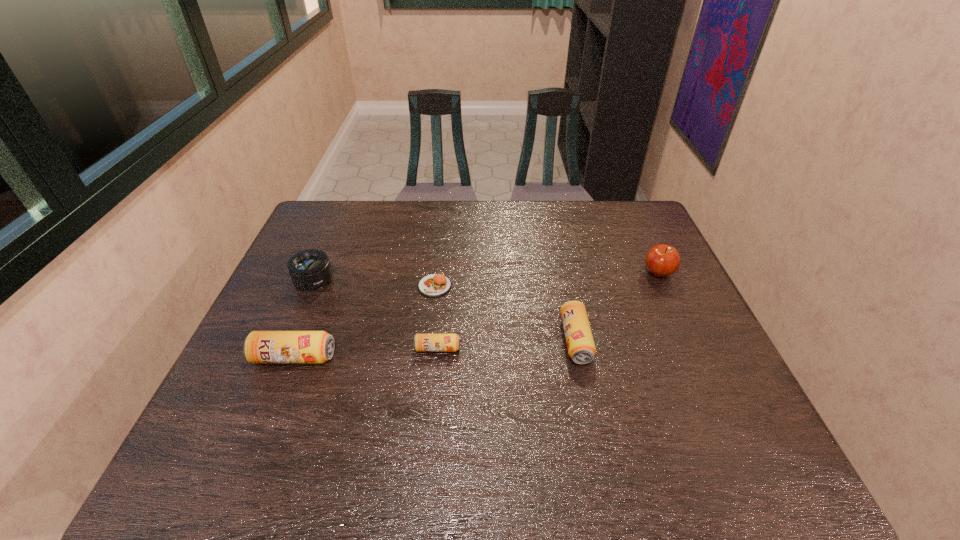
Image resolution: width=960 pixels, height=540 pixels. In order to click on free space between the telephoto lens and the fifth object from left to right in this screenshot , I will do `click(444, 310)`.

Find the location of a particular element. vacant point located between the telephoto lens and the apple is located at coordinates (486, 277).

The height and width of the screenshot is (540, 960). In order to click on free space between the leftmost beer can and the shortest object in this screenshot , I will do `click(365, 322)`.

Locate which object ranks third in proximity to the telephoto lens. Please provide its 2D coordinates. Your answer should be formatted as a tuple, i.e. [(x, y)], where the tuple contains the x and y coordinates of a point satisfying the conditions above.

[(422, 342)]

Identify which object is located as the third nearest to the telephoto lens. Please provide its 2D coordinates. Your answer should be formatted as a tuple, i.e. [(x, y)], where the tuple contains the x and y coordinates of a point satisfying the conditions above.

[(422, 342)]

Image resolution: width=960 pixels, height=540 pixels. I want to click on beer can that is the second closest to the second shortest beer can, so click(259, 346).

This screenshot has width=960, height=540. In order to click on beer can identified as the third closest to the tallest object in this screenshot , I will do `click(259, 346)`.

Locate an element on the screen. Image resolution: width=960 pixels, height=540 pixels. vacant point that satisfies the following two spatial constraints: 1. on the side of the rightmost beer can with brand markings and control switches; 2. on the left side of the telephoto lens is located at coordinates (289, 340).

Locate an element on the screen. The width and height of the screenshot is (960, 540). free location that satisfies the following two spatial constraints: 1. on the side of the second beer can from right to left with brand markings and control switches; 2. on the right side of the telephoto lens is located at coordinates (285, 348).

Locate an element on the screen. The width and height of the screenshot is (960, 540). vacant region that satisfies the following two spatial constraints: 1. on the back side of the shortest object; 2. on the right side of the apple is located at coordinates (436, 273).